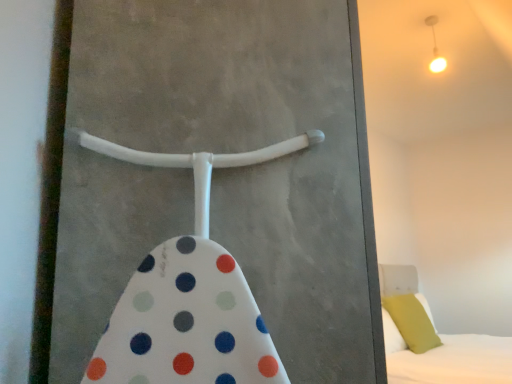
Question: Considering the positions of white soft bed at lower right and soft green pillow at right in the image, is white soft bed at lower right wider or thinner than soft green pillow at right?

Choices:
 (A) thin
 (B) wide

Answer: (B)

Question: From the image's perspective, relative to soft green pillow at right, is white soft bed at lower right above or below?

Choices:
 (A) above
 (B) below

Answer: (B)

Question: Which object is positioned closest to the matte white light fixture at upper right?

Choices:
 (A) soft green pillow at right
 (B) white plastic screen door at center
 (C) white soft bed at lower right

Answer: (A)

Question: Based on their relative distances, which object is farther from the white soft bed at lower right?

Choices:
 (A) white plastic screen door at center
 (B) soft green pillow at right
 (C) matte white light fixture at upper right

Answer: (A)